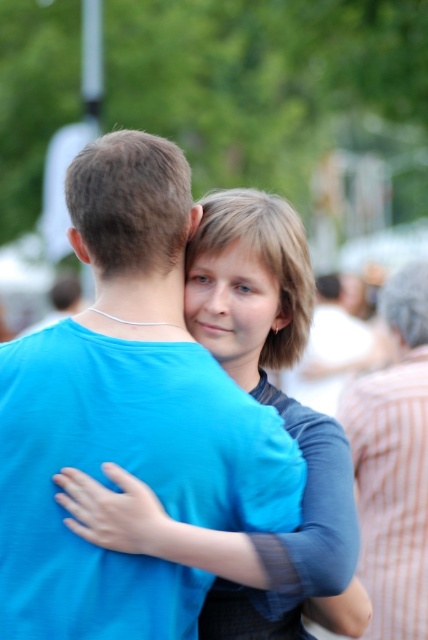
Question: Does blue matte shirt at center appear under striped cotton shirt at right?

Choices:
 (A) no
 (B) yes

Answer: (A)

Question: Can you confirm if blue matte shirt at center is wider than striped cotton shirt at right?

Choices:
 (A) yes
 (B) no

Answer: (A)

Question: Which point is closer to the camera taking this photo?

Choices:
 (A) (392, 436)
 (B) (27, 376)

Answer: (B)

Question: Is blue matte shirt at center below striped cotton shirt at right?

Choices:
 (A) no
 (B) yes

Answer: (A)